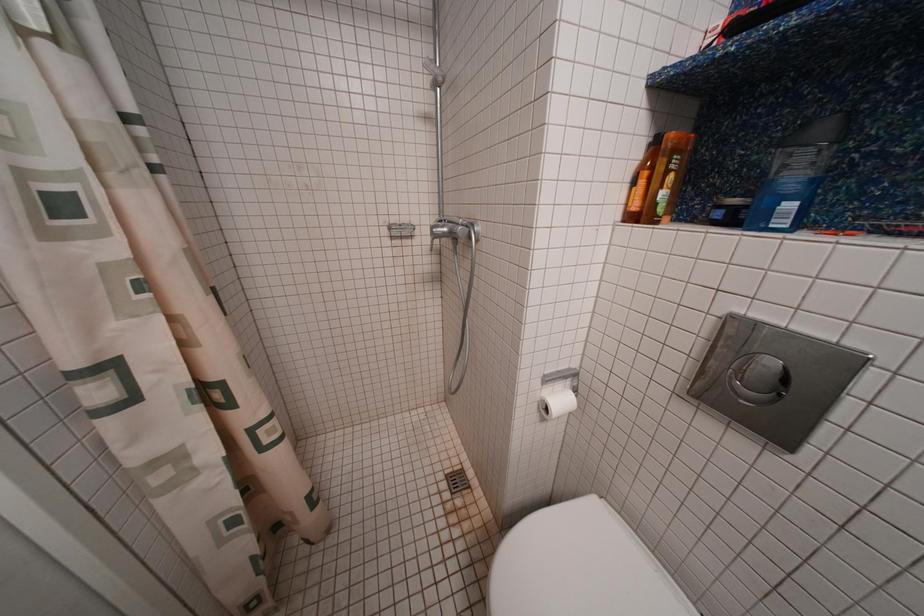
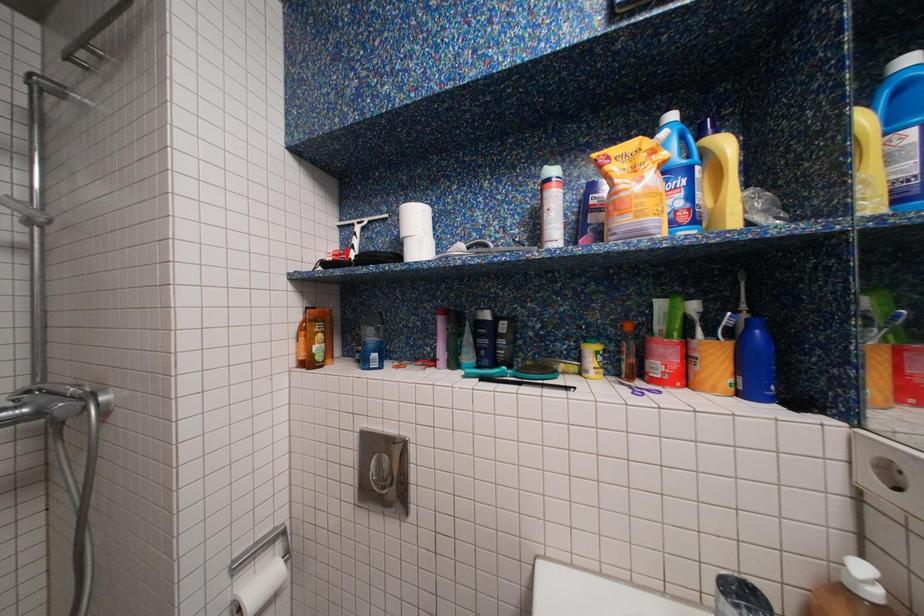
How did the camera likely rotate?

The camera's rotation is toward right-up.